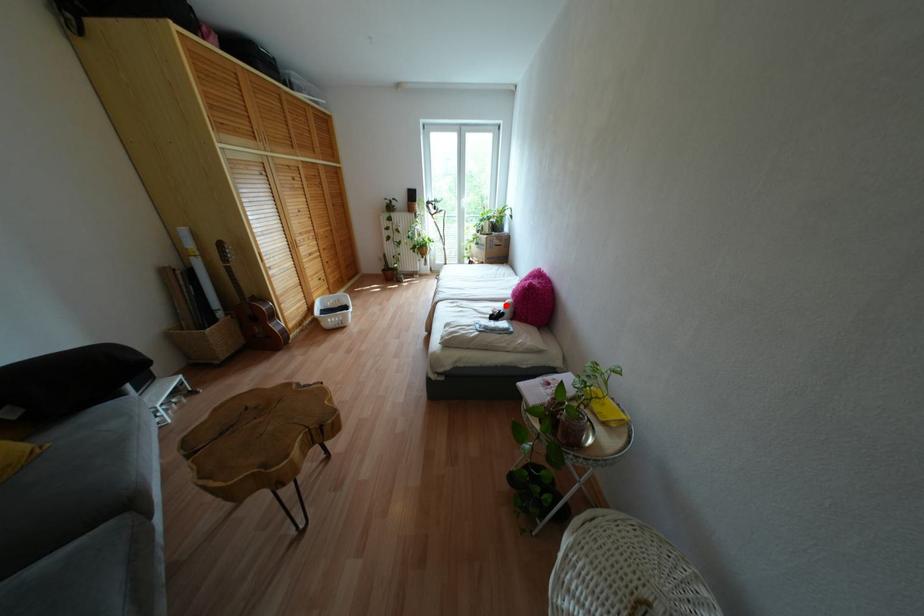
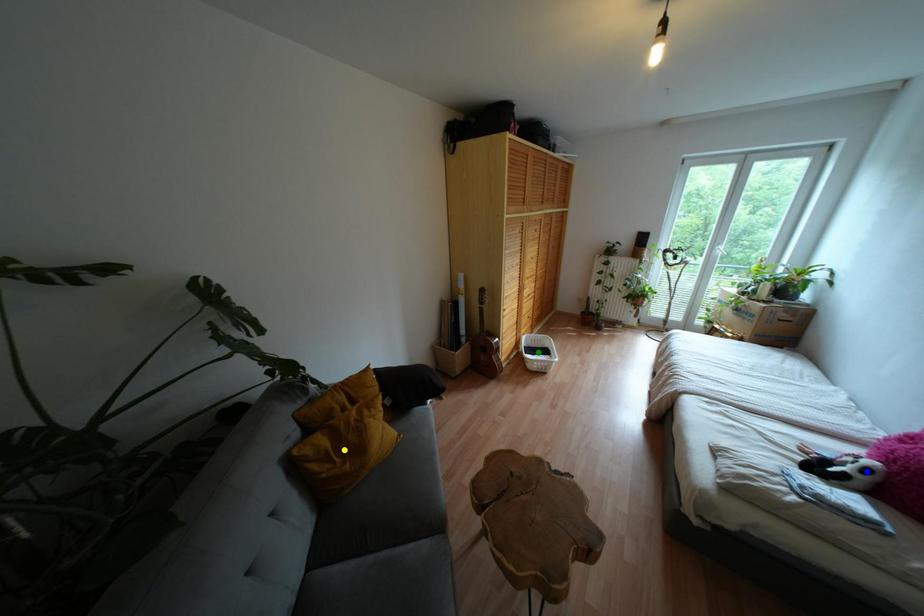
Question: I am providing you with two images of the same scene from different viewpoints. A red point is marked on the first image. You are given multiple points on the second image. Which spot in image 2 lines up with the point in image 1?

Choices:
 (A) green point
 (B) blue point
 (C) yellow point

Answer: (B)